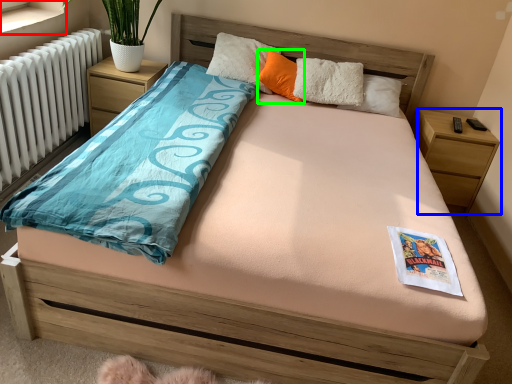
Question: Which object is the farthest from window sill (highlighted by a red box)? Choose among these: nightstand (highlighted by a blue box) or pillow (highlighted by a green box).

Choices:
 (A) nightstand
 (B) pillow

Answer: (A)